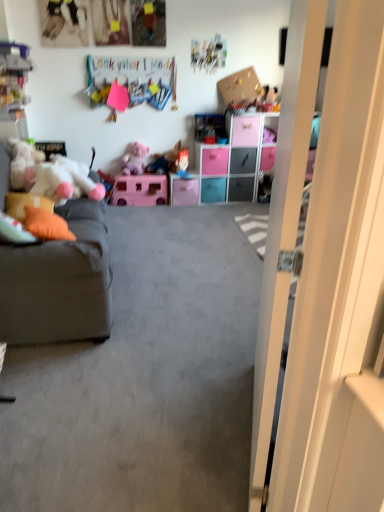
Question: Should I look upward or downward to see white glossy door at right?

Choices:
 (A) up
 (B) down

Answer: (A)

Question: From a real-world perspective, is black plastic drawer at center, the 3th drawer when ordered from right to left, beneath pink plastic drawer at center, marked as the fourth drawer in a right-to-left arrangement?

Choices:
 (A) no
 (B) yes

Answer: (B)

Question: Does black plastic drawer at center, the 3th drawer when ordered from right to left, have a lesser height compared to pink plastic drawer at center, which is the 3th drawer from left to right?

Choices:
 (A) yes
 (B) no

Answer: (A)

Question: Does black plastic drawer at center, the 3th drawer when ordered from right to left, appear on the left side of pink plastic drawer at center, marked as the fourth drawer in a right-to-left arrangement?

Choices:
 (A) no
 (B) yes

Answer: (A)

Question: Is black plastic drawer at center, the 3th drawer when ordered from right to left, aimed at pink plastic drawer at center, marked as the fourth drawer in a right-to-left arrangement?

Choices:
 (A) yes
 (B) no

Answer: (B)

Question: Does black plastic drawer at center, the 3th drawer when ordered from right to left, lie in front of pink plastic drawer at center, marked as the fourth drawer in a right-to-left arrangement?

Choices:
 (A) no
 (B) yes

Answer: (A)

Question: Is black plastic drawer at center, the 3th drawer when ordered from right to left, outside of pink plastic drawer at center, marked as the fourth drawer in a right-to-left arrangement?

Choices:
 (A) yes
 (B) no

Answer: (A)

Question: Is gray fabric couch at left located outside plush pink teddy bear at center, arranged as the 4th toy when viewed from the right?

Choices:
 (A) yes
 (B) no

Answer: (A)

Question: From the image's perspective, is gray fabric couch at left below plush pink teddy bear at center, positioned as the 4th toy in back-to-front order?

Choices:
 (A) no
 (B) yes

Answer: (B)

Question: Does gray fabric couch at left have a smaller size compared to plush pink teddy bear at center, arranged as the second toy when viewed from the front?

Choices:
 (A) no
 (B) yes

Answer: (A)

Question: Does gray fabric couch at left have a greater width compared to plush pink teddy bear at center, arranged as the 4th toy when viewed from the right?

Choices:
 (A) no
 (B) yes

Answer: (B)

Question: Is gray fabric couch at left oriented towards plush pink teddy bear at center, positioned as the 4th toy in back-to-front order?

Choices:
 (A) yes
 (B) no

Answer: (B)

Question: Does gray fabric couch at left appear on the right side of plush pink teddy bear at center, positioned as the 4th toy in back-to-front order?

Choices:
 (A) no
 (B) yes

Answer: (A)

Question: Considering the relative positions of orange fabric pillow at left, arranged as the 2th pillow when viewed from the left, and plush mickey mouse at upper right, which is counted as the first toy, starting from the back, in the image provided, is orange fabric pillow at left, arranged as the 2th pillow when viewed from the left, to the left of plush mickey mouse at upper right, which is counted as the first toy, starting from the back, from the viewer's perspective?

Choices:
 (A) no
 (B) yes

Answer: (B)